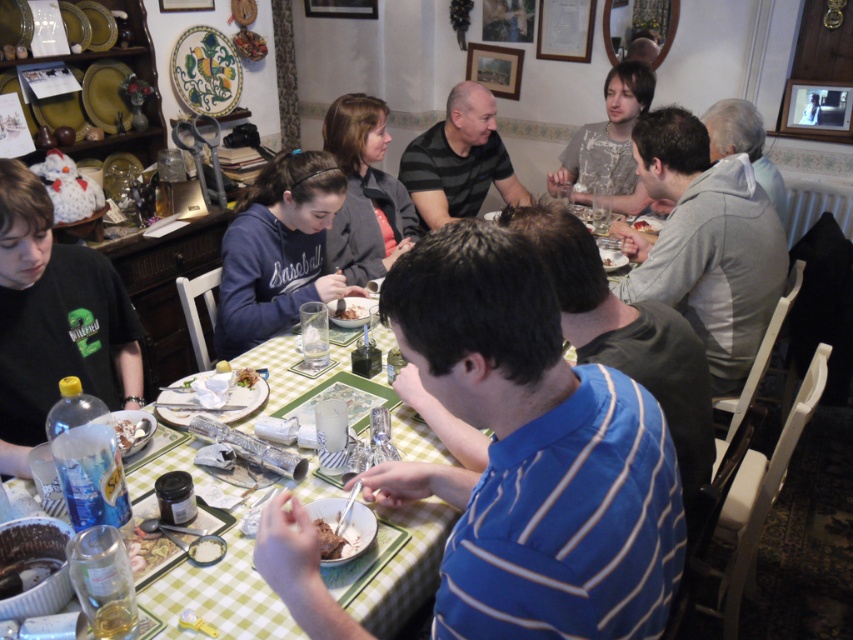
You are a guest at the table and want to choose a dish to serve yourself. The smooth white bowl at center and the brown crumbly cake at lower center are both available. Which one do you think is smaller in size?

The smooth white bowl at center is smaller in size compared to the brown crumbly cake at lower center, so you should choose the smooth white bowl at center if you want a smaller dish.

You are a guest at the table and want to reach the smooth chocolate cake at center. Which direction should you move relative to your current position at point (350,308)?

The smooth chocolate cake at center is located exactly at your current position at point (350,308), so you don not need to move in any direction.

You are a guest at the dining table and need to locate the black striped shirt at center. According to the coordinates provided, where exactly is the black striped shirt positioned?

The black striped shirt at center is located at point coordinates of 0.252 on the x axis and 0.539 on the y axis.